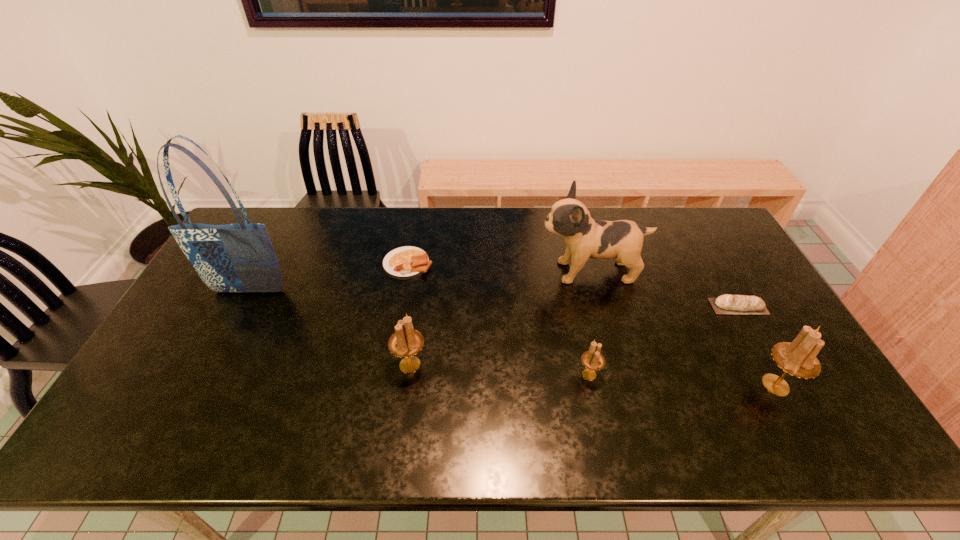
Where is `free spot between the fourth shortest object and the omelet`? The height and width of the screenshot is (540, 960). free spot between the fourth shortest object and the omelet is located at coordinates (409, 314).

Where is `vacant area between the fourth farthest object and the shortest object`? This screenshot has height=540, width=960. vacant area between the fourth farthest object and the shortest object is located at coordinates (573, 285).

Image resolution: width=960 pixels, height=540 pixels. I want to click on vacant space that's between the rightmost candle holder and the shortest object, so click(x=591, y=325).

Locate an element on the screen. This screenshot has height=540, width=960. free spot between the third shortest object and the pita bread is located at coordinates (663, 341).

The height and width of the screenshot is (540, 960). In order to click on free spot between the omelet and the shortest candle holder in this screenshot , I will do `click(498, 319)`.

The height and width of the screenshot is (540, 960). In order to click on free space between the shopping bag and the sixth tallest object in this screenshot , I will do `click(493, 299)`.

In order to click on free spot between the fourth shortest object and the shortest object in this screenshot , I will do `click(409, 314)`.

Find the location of `free spot between the leftmost object and the puppy`. free spot between the leftmost object and the puppy is located at coordinates (420, 282).

Locate which object is the third closest to the second candle holder from right to left. Please provide its 2D coordinates. Your answer should be formatted as a tuple, i.e. [(x, y)], where the tuple contains the x and y coordinates of a point satisfying the conditions above.

[(405, 342)]

Locate an element on the screen. The width and height of the screenshot is (960, 540). object that is the closest to the omelet is located at coordinates (240, 257).